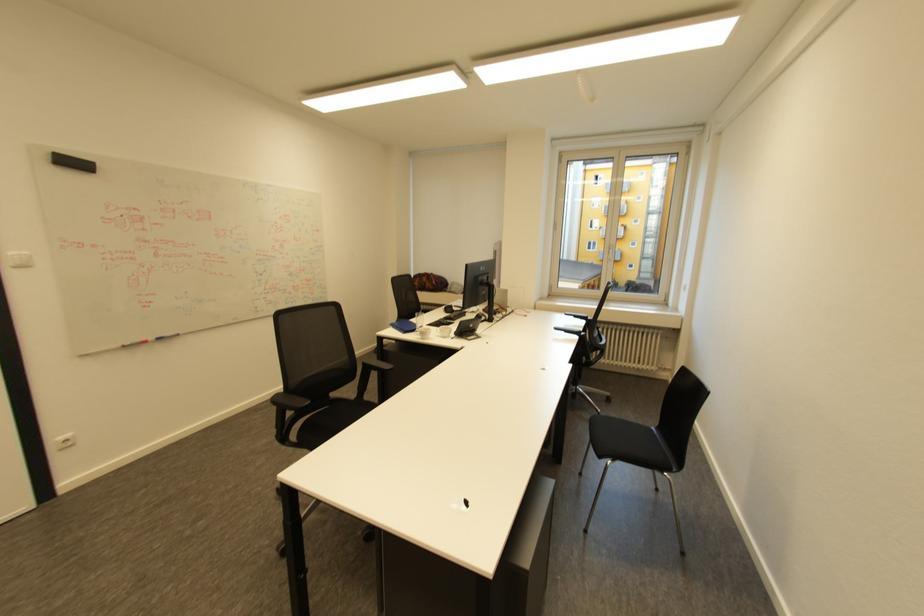
The location [134,344] corresponds to which object?

It refers to a red whiteboard marker.